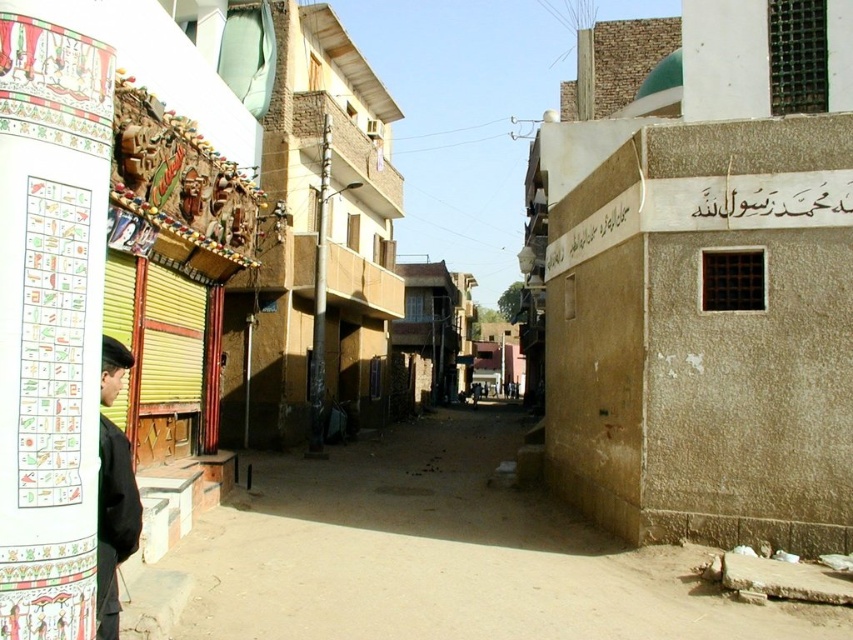
You are a delivery person who needs to navigate through the narrow street scene. You see a dull concrete alley at center and a white stone sign at upper right. Which object takes up more space in the image?

The dull concrete alley at center has a larger size compared to the white stone sign at upper right, so the dull concrete alley at center takes up more space in the image.

You are standing at the entrance of the narrow street scene. There is a dull concrete alley at center located at point [434,556]. Can you walk straight ahead towards the entrance of the building with decorative facade on the left?

The dull concrete alley at center is located at point [434,556], so yes, you can walk straight ahead towards the entrance of the building with decorative facade on the left as the alley is directly in front of you.